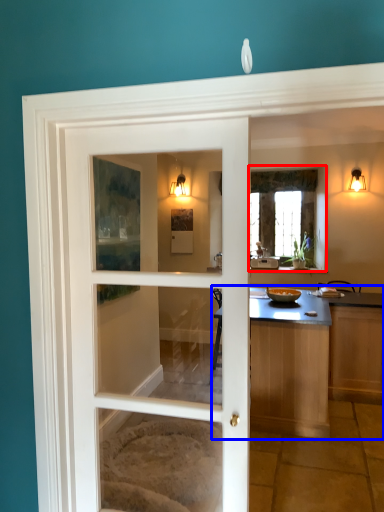
Question: Which object appears closest to the camera in this image, window (highlighted by a red box) or countertop (highlighted by a blue box)?

Choices:
 (A) window
 (B) countertop

Answer: (B)